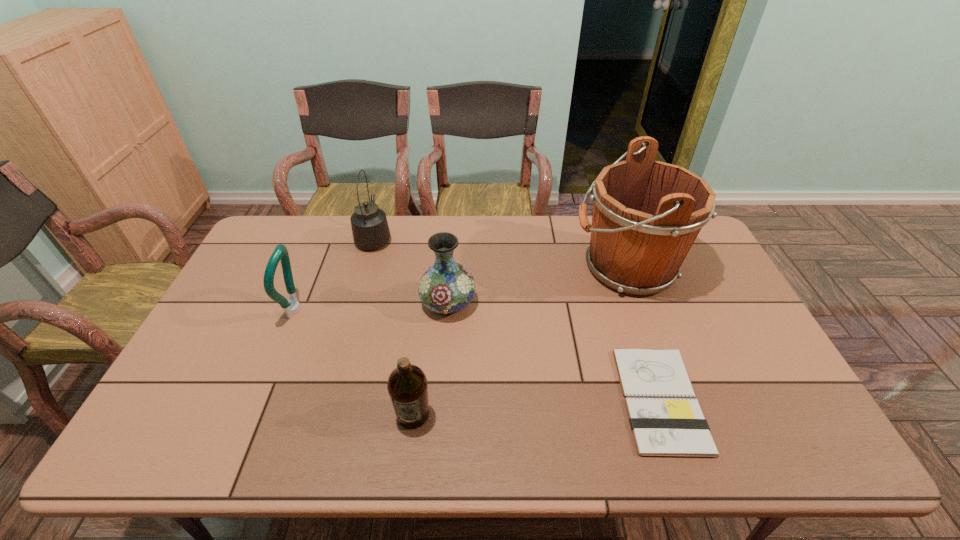
The height and width of the screenshot is (540, 960). In the image, there is a desktop. In order to click on vacant space at the left edge in this screenshot , I will do `click(212, 383)`.

In the image, there is a desktop. Where is `free space at the far left corner`? free space at the far left corner is located at coordinates (284, 241).

This screenshot has width=960, height=540. I want to click on free space that is in between the notepad and the second object from left to right, so click(x=517, y=319).

Locate an element on the screen. The image size is (960, 540). vacant area that lies between the kettle and the bucket is located at coordinates (500, 253).

Locate an element on the screen. This screenshot has width=960, height=540. vacant point located between the shortest object and the leftmost object is located at coordinates (478, 354).

Where is `vacant point located between the vase and the tallest object`? vacant point located between the vase and the tallest object is located at coordinates (537, 286).

The image size is (960, 540). I want to click on free point between the bottle opener and the olive oil, so click(x=354, y=362).

Where is `blank region between the kettle and the tallest object`? blank region between the kettle and the tallest object is located at coordinates click(500, 253).

I want to click on empty space between the notepad and the bottle opener, so click(x=478, y=354).

You are a GUI agent. You are given a task and a screenshot of the screen. Output one action in this format:
    pyautogui.click(x=<x>, y=<y>)
    Task: Click on the free point between the olive oil and the kettle
    This screenshot has height=540, width=960.
    Given the screenshot: What is the action you would take?
    pyautogui.click(x=394, y=326)